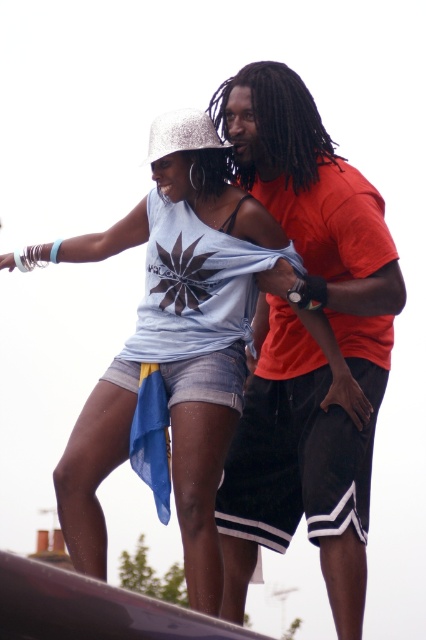
Question: Which object appears closest to the camera in this image?

Choices:
 (A) orange matte shirt at upper right
 (B) matte blue denim shorts at center

Answer: (B)

Question: Does orange matte shirt at upper right come behind matte blue denim shorts at center?

Choices:
 (A) yes
 (B) no

Answer: (A)

Question: Is orange matte shirt at upper right smaller than matte blue denim shorts at center?

Choices:
 (A) yes
 (B) no

Answer: (A)

Question: Can you confirm if orange matte shirt at upper right is wider than matte blue denim shorts at center?

Choices:
 (A) no
 (B) yes

Answer: (A)

Question: Which point appears closest to the camera in this image?

Choices:
 (A) (150, 152)
 (B) (313, 284)

Answer: (A)